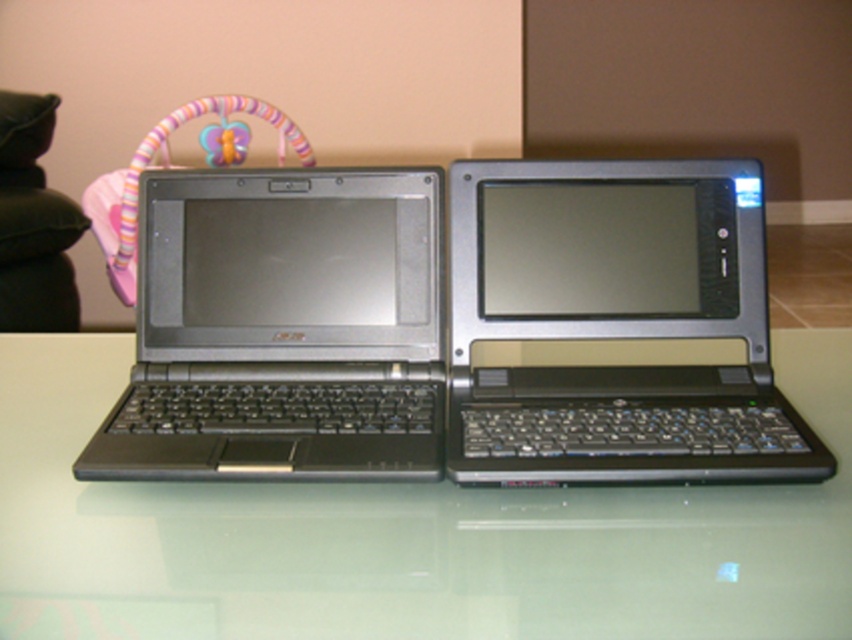
Is black matte laptop at left to the right of velvety pink pillow at left from the viewer's perspective?

Yes, black matte laptop at left is to the right of velvety pink pillow at left.

Can you confirm if black matte laptop at left is bigger than velvety pink pillow at left?

No, black matte laptop at left is not bigger than velvety pink pillow at left.

This screenshot has height=640, width=852. Find the location of `black matte laptop at left`. black matte laptop at left is located at coordinates (283, 328).

Can you confirm if white glossy table at center is smaller than velvety pink pillow at left?

No, white glossy table at center is not smaller than velvety pink pillow at left.

Can you confirm if white glossy table at center is positioned above velvety pink pillow at left?

Incorrect, white glossy table at center is not positioned above velvety pink pillow at left.

Locate an element on the screen. white glossy table at center is located at coordinates (x=406, y=536).

Which is in front, point (734, 381) or point (344, 208)?

Point (734, 381) is more forward.

Which is below, satin black laptop at center or black matte laptop at left?

black matte laptop at left is below.

Who is more forward, (465,198) or (412,397)?

Point (412,397) is more forward.

Where is `satin black laptop at center`? The width and height of the screenshot is (852, 640). satin black laptop at center is located at coordinates (614, 323).